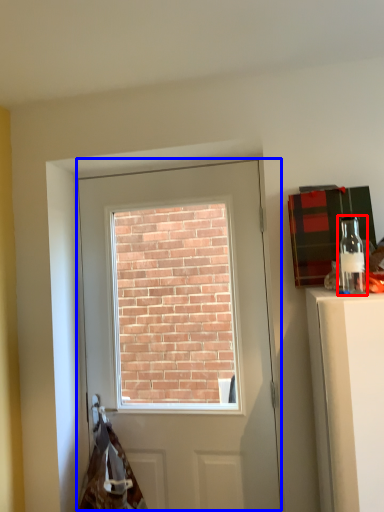
Question: Which of the following is the farthest to the observer, bottle (highlighted by a red box) or door (highlighted by a blue box)?

Choices:
 (A) bottle
 (B) door

Answer: (B)